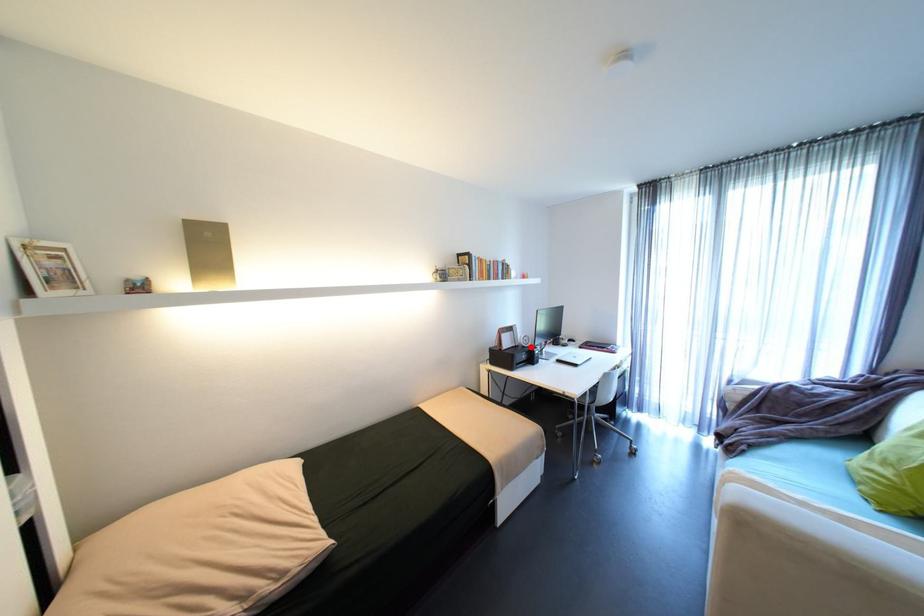
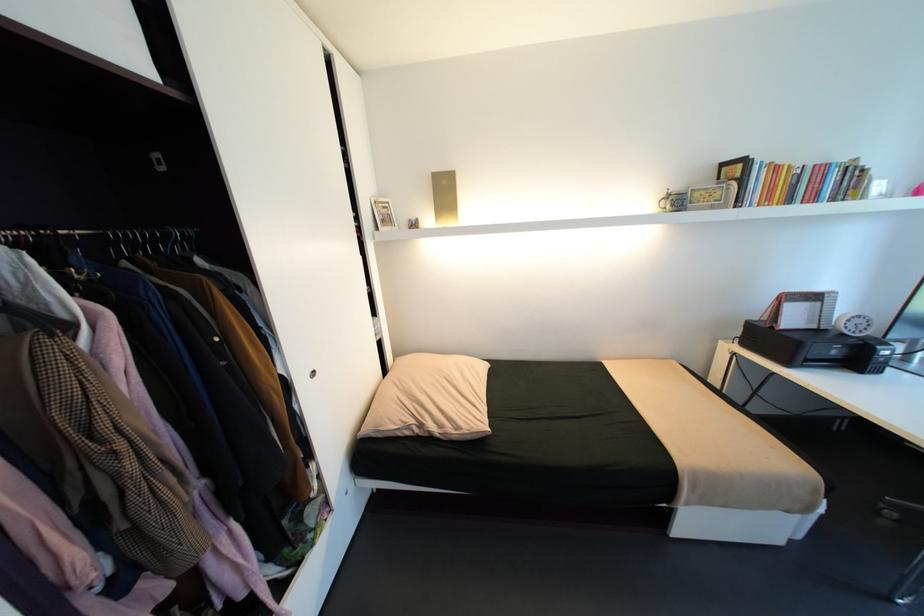
Question: A red point is marked in image1. In image2, is the corresponding 3D point closer to the camera or farther? Reply with the corresponding letter.

Choices:
 (A) The corresponding 3D point is closer.
 (B) The corresponding 3D point is farther.

Answer: (A)